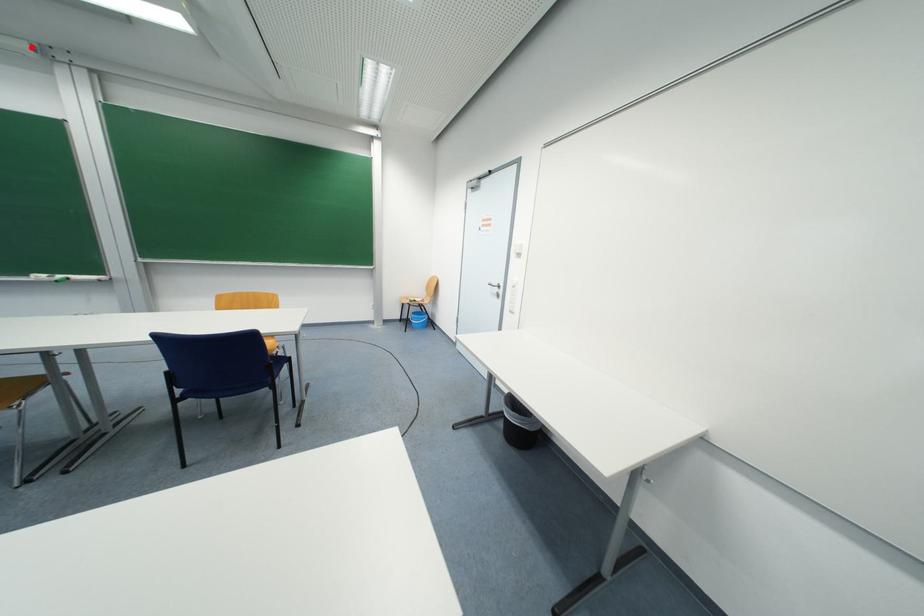
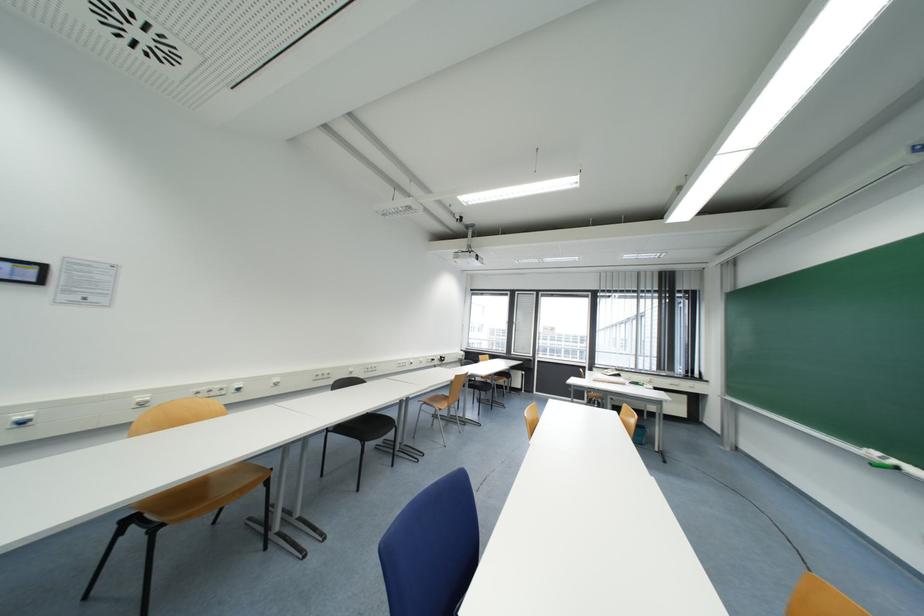
Where in the second image is the point corresponding to the highlighted location from the first image?

(909, 154)